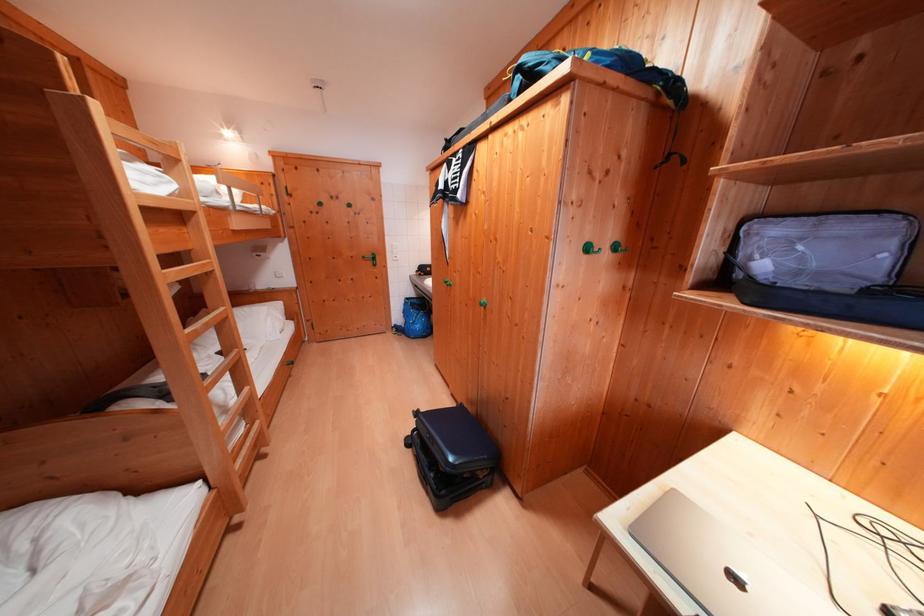
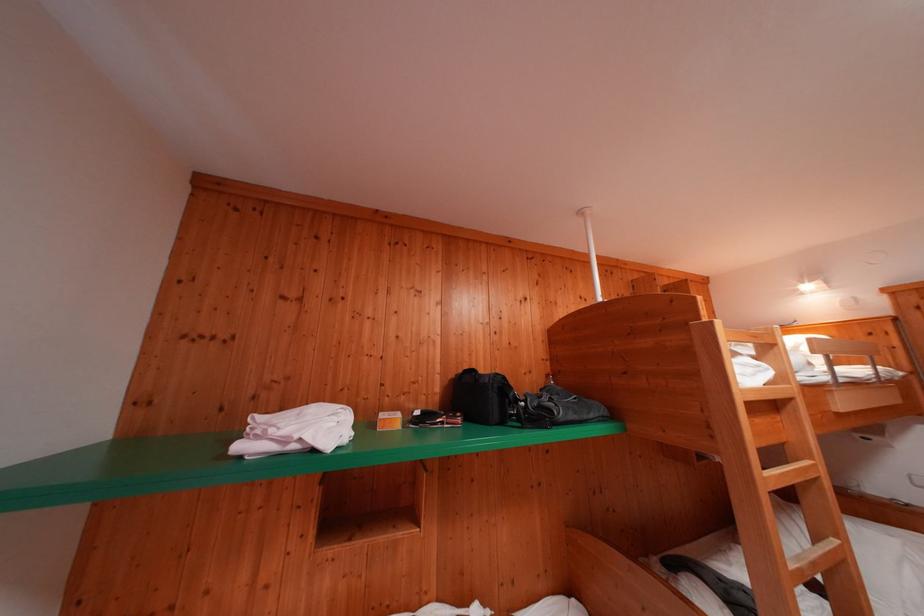
Where in the second image is the point corresponding to the point at 164,188 from the first image?

(762, 379)